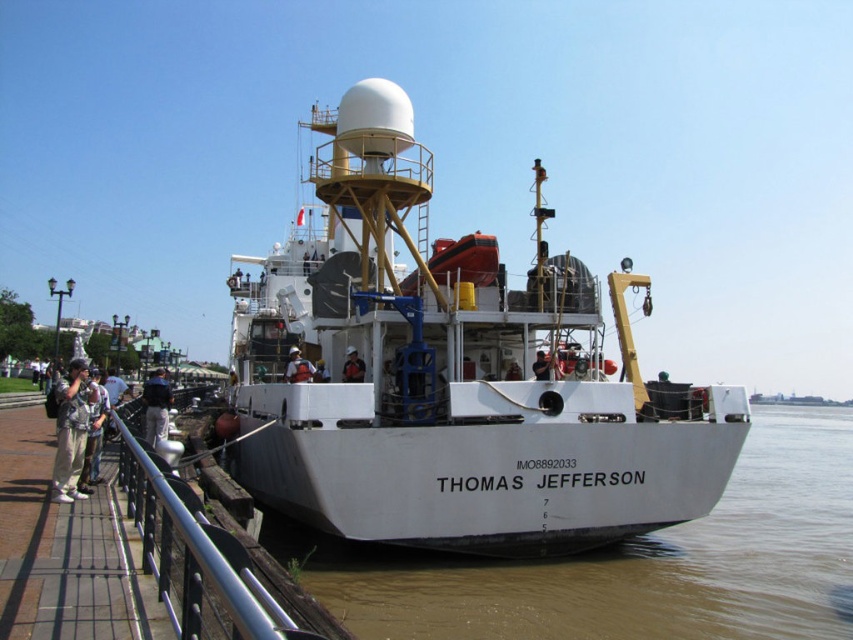
Question: Is camouflage fabric jacket at left in front of blue fabric umbrella at lower left?

Choices:
 (A) no
 (B) yes

Answer: (B)

Question: Which point is farther to the camera?

Choices:
 (A) denim jacket at left
 (B) white matte water at lower center

Answer: (B)

Question: Is the position of white matte water at lower center more distant than that of matte black helmet at center?

Choices:
 (A) yes
 (B) no

Answer: (B)

Question: Is silver metallic railing at lower left below white matte helmet at center?

Choices:
 (A) yes
 (B) no

Answer: (A)

Question: Which point is closer to the camera?

Choices:
 (A) (79, 412)
 (B) (97, 403)
 (C) (450, 387)

Answer: (A)

Question: Estimate the real-world distances between objects in this image. Which object is farther from the blue fabric umbrella at lower left?

Choices:
 (A) red fabric jacket at center
 (B) silver metallic railing at lower left

Answer: (B)